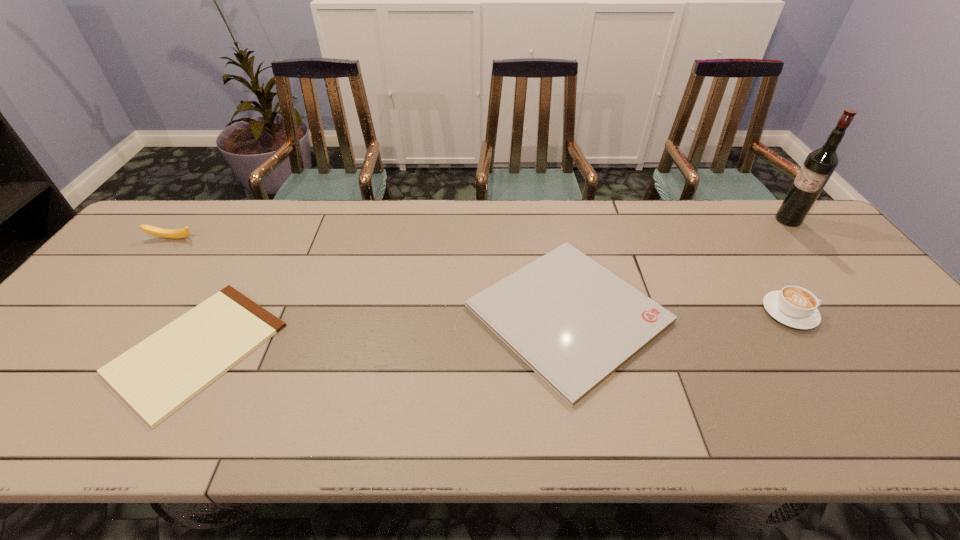
The width and height of the screenshot is (960, 540). Find the location of `free space that is in between the shortest object and the tallest object`. free space that is in between the shortest object and the tallest object is located at coordinates (492, 284).

Identify the location of unoccupied position between the cappuccino and the fourth tallest object. point(679,313).

Where is `unoccupied position between the banana and the right clipboard`? This screenshot has height=540, width=960. unoccupied position between the banana and the right clipboard is located at coordinates (371, 276).

Find the location of `vacant area between the second shortest object and the tallest object`. vacant area between the second shortest object and the tallest object is located at coordinates (678, 267).

Find the location of a particular element. This screenshot has width=960, height=540. empty space that is in between the taller clipboard and the banana is located at coordinates (371, 276).

Where is `object that is the third closest to the second shortest object`? This screenshot has width=960, height=540. object that is the third closest to the second shortest object is located at coordinates (818, 167).

Select which object is the closest to the banana. Please provide its 2D coordinates. Your answer should be formatted as a tuple, i.e. [(x, y)], where the tuple contains the x and y coordinates of a point satisfying the conditions above.

[(156, 377)]

Locate an element on the screen. free point that satisfies the following two spatial constraints: 1. at the stem of the banana; 2. on the right side of the shortest object is located at coordinates (86, 348).

I want to click on vacant region that satisfies the following two spatial constraints: 1. at the stem of the third object from left to right; 2. on the left side of the banana, so click(x=113, y=314).

Locate an element on the screen. vacant point that satisfies the following two spatial constraints: 1. on the front and back of the wine bottle; 2. at the stem of the second farthest object is located at coordinates (804, 239).